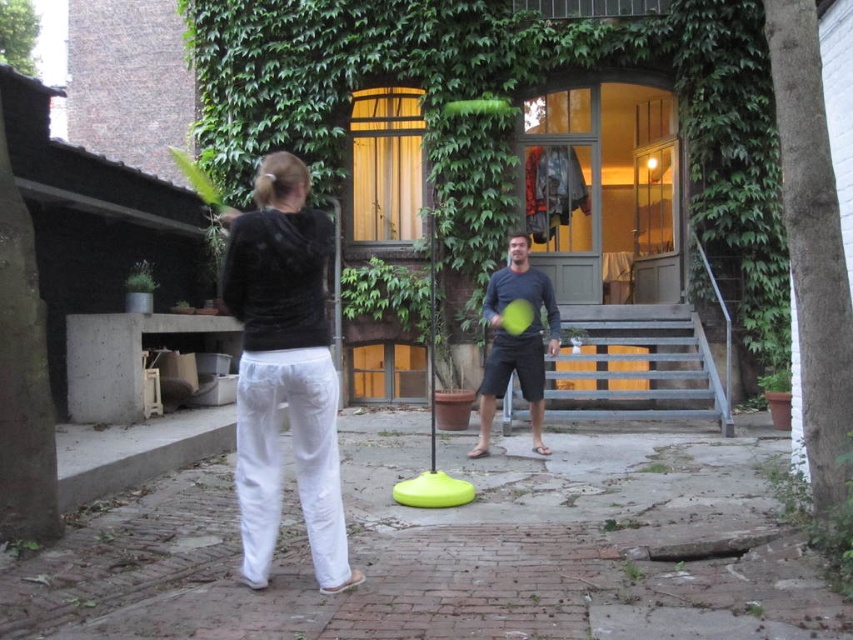
Is velvet black hoodie at center smaller than dark blue cotton shirt at center?

No, velvet black hoodie at center is not smaller than dark blue cotton shirt at center.

Does velvet black hoodie at center have a greater height compared to dark blue cotton shirt at center?

Correct, velvet black hoodie at center is much taller as dark blue cotton shirt at center.

Identify the location of velvet black hoodie at center. This screenshot has width=853, height=640. (283, 371).

You are a GUI agent. You are given a task and a screenshot of the screen. Output one action in this format:
    pyautogui.click(x=<x>, y=<y>)
    Task: Click on the velvet black hoodie at center
    
    Given the screenshot: What is the action you would take?
    pyautogui.click(x=283, y=371)